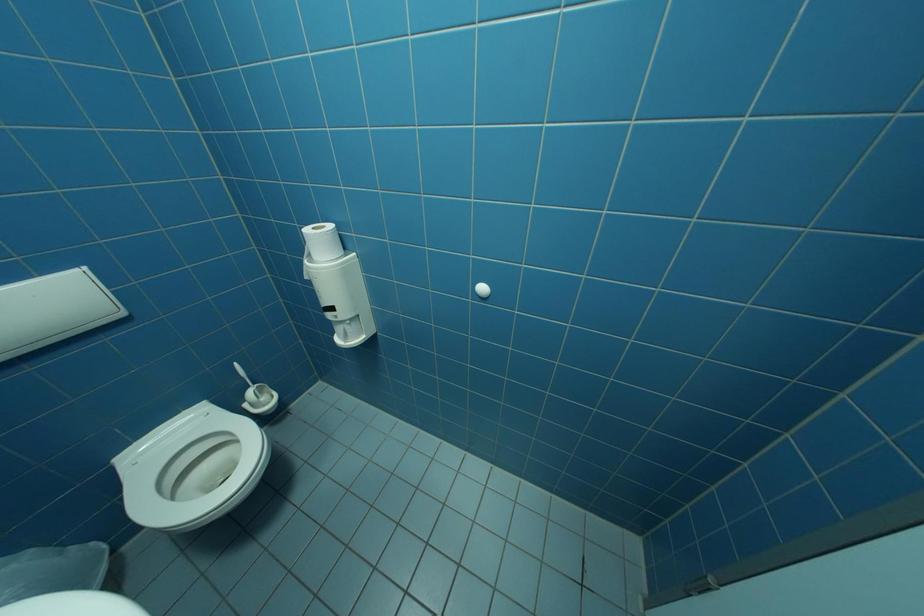
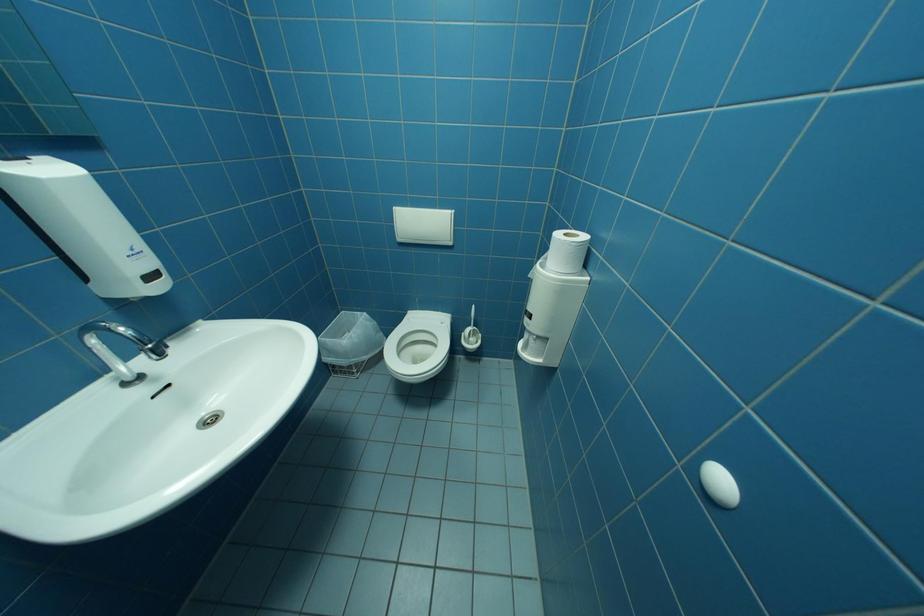
Based on the continuous images, in which direction is the camera rotating?

The camera's rotation is toward left-down.